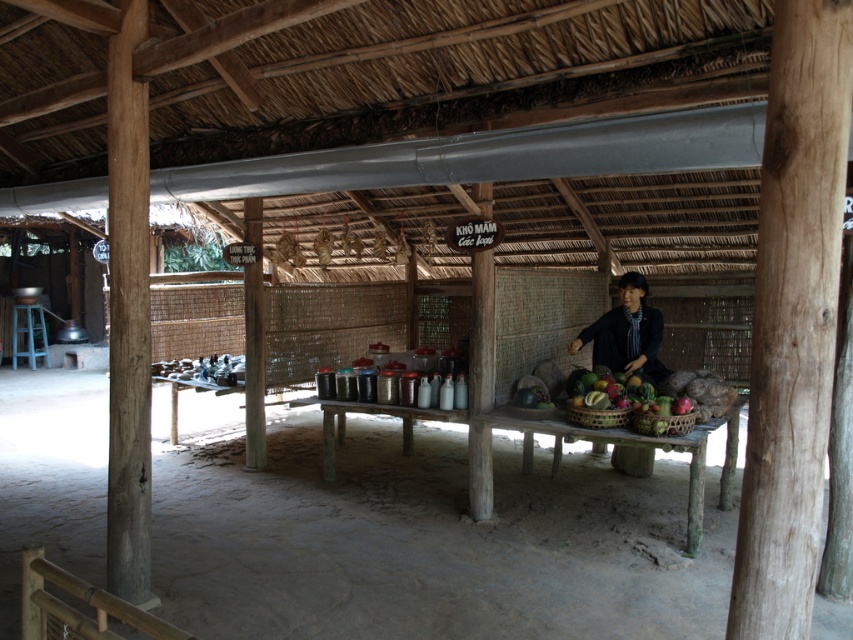
You are a customer at the rustic open air market stall. You want to place a large bag on the wooden table at center without covering the brown woven basket at center. Is there enough space?

The wooden table at center is larger in size than the brown woven basket at center, so there should be enough space to place the large bag on the wooden table at center without covering the brown woven basket at center.

You are a customer at the rustic open air market stall. You want to place a heavy item on the surface that can support it. Which object between the wooden table at center and the brown woven basket at center would be more suitable for this task?

The wooden table at center is much taller than the brown woven basket at center, so it is more suitable for placing a heavy item as it likely has a sturdier and more stable surface.

Based on the photo, you are a customer at the rustic open air market stall. You want to buy some fresh produce from the wooden table at center and the brown woven basket at center. Which one is closer to your right side when facing the stall?

The brown woven basket at center is to the right of the wooden table at center, so if you are facing the stall, the brown woven basket at center will be closer to your right side.